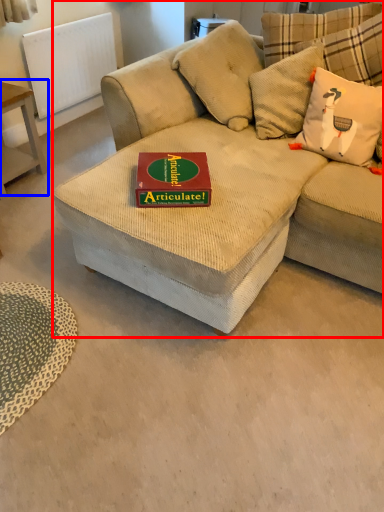
Question: Which object appears farthest to the camera in this image, studio couch (highlighted by a red box) or table (highlighted by a blue box)?

Choices:
 (A) studio couch
 (B) table

Answer: (B)